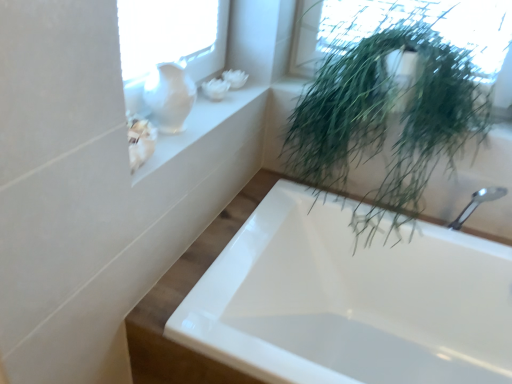
Question: Is white glass vase at upper left oriented away from green leafy plant at upper right?

Choices:
 (A) no
 (B) yes

Answer: (A)

Question: Does white glass vase at upper left have a lesser height compared to green leafy plant at upper right?

Choices:
 (A) no
 (B) yes

Answer: (B)

Question: Can you confirm if white glass vase at upper left is thinner than green leafy plant at upper right?

Choices:
 (A) no
 (B) yes

Answer: (B)

Question: From a real-world perspective, is white glass vase at upper left located beneath green leafy plant at upper right?

Choices:
 (A) yes
 (B) no

Answer: (B)

Question: From a real-world perspective, is white glass vase at upper left over green leafy plant at upper right?

Choices:
 (A) yes
 (B) no

Answer: (A)

Question: Is white glossy bathtub at lower right inside or outside of white glass vase at upper left?

Choices:
 (A) outside
 (B) inside

Answer: (A)

Question: Is white glossy bathtub at lower right taller or shorter than white glass vase at upper left?

Choices:
 (A) tall
 (B) short

Answer: (A)

Question: Is white glossy bathtub at lower right in front of or behind white glass vase at upper left in the image?

Choices:
 (A) front
 (B) behind

Answer: (A)

Question: In terms of size, does white glossy bathtub at lower right appear bigger or smaller than white glass vase at upper left?

Choices:
 (A) big
 (B) small

Answer: (A)

Question: From a real-world perspective, is white glossy vase at upper left above or below white glossy bathtub at lower right?

Choices:
 (A) above
 (B) below

Answer: (A)

Question: Relative to white glossy bathtub at lower right, is white glossy vase at upper left in front or behind?

Choices:
 (A) front
 (B) behind

Answer: (B)

Question: From the image's perspective, is white glossy vase at upper left positioned above or below white glossy bathtub at lower right?

Choices:
 (A) above
 (B) below

Answer: (A)

Question: Considering the positions of white glossy vase at upper left and white glossy bathtub at lower right in the image, is white glossy vase at upper left bigger or smaller than white glossy bathtub at lower right?

Choices:
 (A) small
 (B) big

Answer: (A)

Question: Considering the positions of green leafy plant at upper right and white glossy vase at upper left in the image, is green leafy plant at upper right wider or thinner than white glossy vase at upper left?

Choices:
 (A) thin
 (B) wide

Answer: (B)

Question: Considering the positions of green leafy plant at upper right and white glossy vase at upper left in the image, is green leafy plant at upper right taller or shorter than white glossy vase at upper left?

Choices:
 (A) tall
 (B) short

Answer: (A)